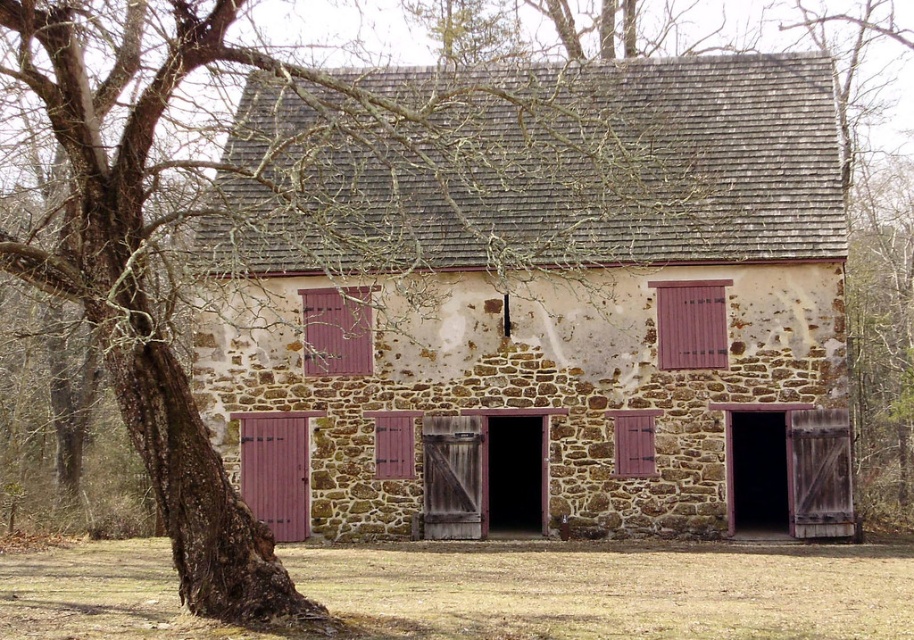
Between pink wood shutter at center and wooden textured shutter at center, which one has less height?

Standing shorter between the two is wooden textured shutter at center.

Between pink wood shutter at center and wooden textured shutter at center, which one is positioned higher?

wooden textured shutter at center

Between point (404, 470) and point (652, 456), which one is positioned behind?

The point (404, 470) is more distant.

You are a GUI agent. You are given a task and a screenshot of the screen. Output one action in this format:
    pyautogui.click(x=<x>, y=<y>)
    Task: Click on the pink wood shutter at center
    This screenshot has height=640, width=914.
    Given the screenshot: What is the action you would take?
    pyautogui.click(x=392, y=442)

Does matte wood door at lower left have a greater width compared to purple wood shutter at right?

Yes.

Who is positioned more to the left, matte wood door at lower left or purple wood shutter at right?

Positioned to the left is matte wood door at lower left.

Between point (263, 435) and point (702, 314), which one is positioned in front?

Point (702, 314)

Find the location of a particular element. Image resolution: width=914 pixels, height=640 pixels. matte wood door at lower left is located at coordinates (275, 470).

Does matte wood door at lower left appear on the right side of matte wood shutter at center?

Incorrect, matte wood door at lower left is not on the right side of matte wood shutter at center.

Does matte wood door at lower left have a lesser height compared to matte wood shutter at center?

No, matte wood door at lower left is not shorter than matte wood shutter at center.

Is point (243, 413) closer to camera compared to point (314, 291)?

No.

Where is `matte wood door at lower left`? matte wood door at lower left is located at coordinates (275, 470).